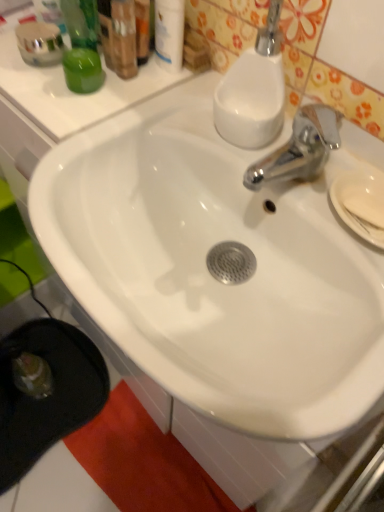
The width and height of the screenshot is (384, 512). I want to click on vacant space positioned to the left of green matte jar at upper left, so click(x=29, y=79).